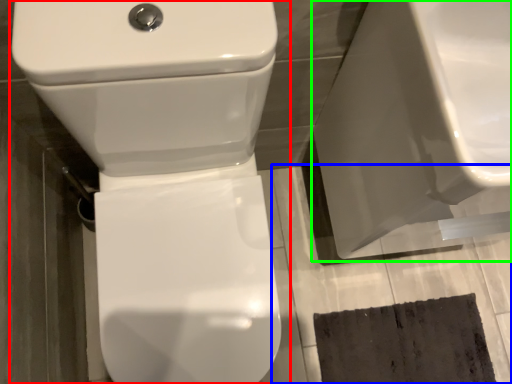
Question: Which is farther away from toilet (highlighted by a red box)? concrete (highlighted by a blue box) or porcelain (highlighted by a green box)?

Choices:
 (A) concrete
 (B) porcelain

Answer: (A)